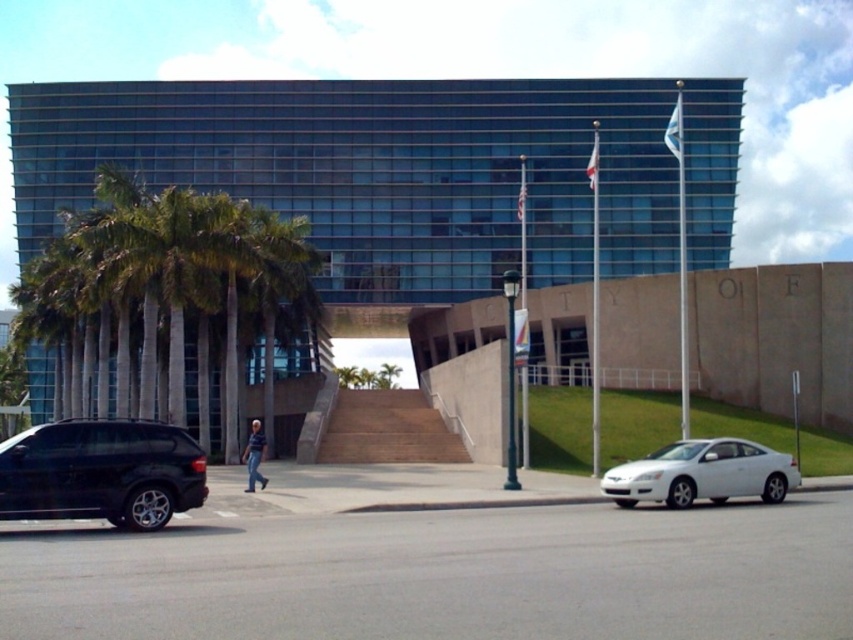
You are a delivery person trying to park a vehicle that is 1.8 meters tall. You see the shiny black suv at lower left and the white glossy car at lower right in the parking area. Which vehicle should you choose to park next to if you want to avoid hitting your delivery vehicle?

The shiny black suv at lower left is not as tall as the white glossy car at lower right, so you should park next to the shiny black suv at lower left to avoid hitting your delivery vehicle since it is shorter.

You are a delivery driver who needs to park your shiny black suv at lower left near the building entrance. The parking spot is at coordinate point 0.739, 0.120. Is your vehicle currently parked in the correct spot?

Yes, the shiny black suv at lower left is already positioned at the specified coordinate point (102, 472), so it is parked correctly.

You are a delivery person trying to park your van between the shiny black suv at lower left and the white glossy car at lower right. Can you fit your van, which is 2 meters wide, in the space between them?

The shiny black suv at lower left is positioned over the white glossy car at lower right, meaning there is no space between them. Therefore, the van cannot fit between them.